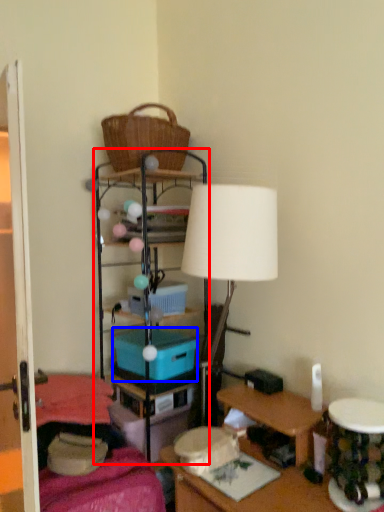
Question: Among these objects, which one is farthest to the camera, shelf (highlighted by a red box) or storage box (highlighted by a blue box)?

Choices:
 (A) shelf
 (B) storage box

Answer: (B)